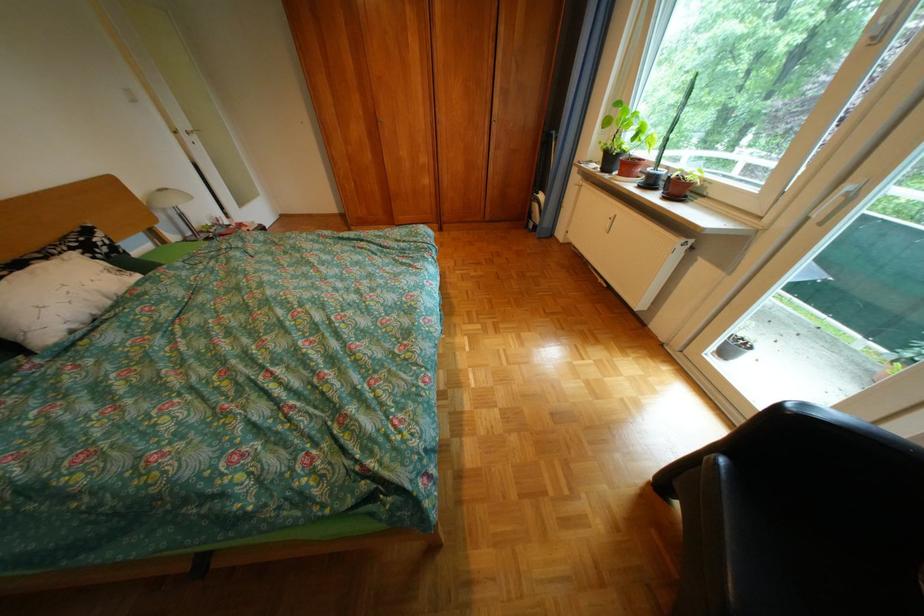
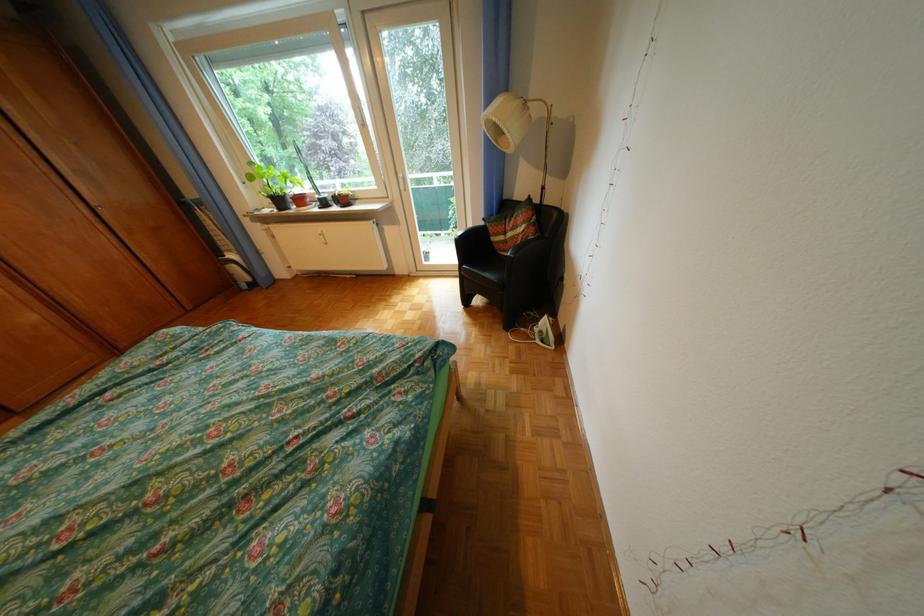
Find the pixel in the second image that matches pixel 673 177 in the first image.

(341, 199)